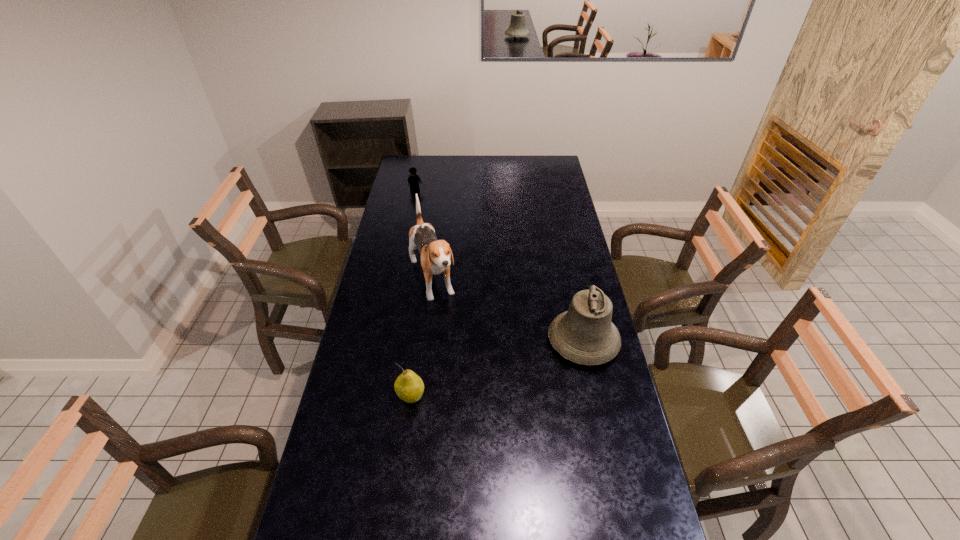
The height and width of the screenshot is (540, 960). I want to click on object that is the second closest to the third nearest object, so (584, 334).

Locate an element on the screen. Image resolution: width=960 pixels, height=540 pixels. the second closest object relative to the nearest object is located at coordinates (584, 334).

Where is `free space that satisfies the following two spatial constraints: 1. on the front side of the Lego; 2. on the right side of the nearest object`? The height and width of the screenshot is (540, 960). free space that satisfies the following two spatial constraints: 1. on the front side of the Lego; 2. on the right side of the nearest object is located at coordinates (375, 397).

Locate an element on the screen. The height and width of the screenshot is (540, 960). vacant region that satisfies the following two spatial constraints: 1. on the back side of the bell; 2. on the right side of the nearest object is located at coordinates (418, 341).

Find the location of a particular element. The image size is (960, 540). free spot that satisfies the following two spatial constraints: 1. on the front side of the Lego; 2. on the right side of the second nearest object is located at coordinates (387, 341).

The height and width of the screenshot is (540, 960). I want to click on free location that satisfies the following two spatial constraints: 1. on the back side of the third farthest object; 2. on the right side of the pear, so click(x=418, y=341).

I want to click on free spot that satisfies the following two spatial constraints: 1. on the back side of the nearest object; 2. on the right side of the rightmost object, so (418, 341).

The width and height of the screenshot is (960, 540). Find the location of `vacant point that satisfies the following two spatial constraints: 1. on the front side of the tallest object; 2. on the left side of the second tallest object`. vacant point that satisfies the following two spatial constraints: 1. on the front side of the tallest object; 2. on the left side of the second tallest object is located at coordinates (424, 341).

You are a GUI agent. You are given a task and a screenshot of the screen. Output one action in this format:
    pyautogui.click(x=<x>, y=<y>)
    Task: Click on the free space that satisfies the following two spatial constraints: 1. on the back side of the nearest object; 2. on the left side of the second farthest object
    This screenshot has width=960, height=540.
    Given the screenshot: What is the action you would take?
    pyautogui.click(x=426, y=281)

I want to click on free space that satisfies the following two spatial constraints: 1. on the front side of the Lego; 2. on the right side of the nearest object, so click(375, 397).